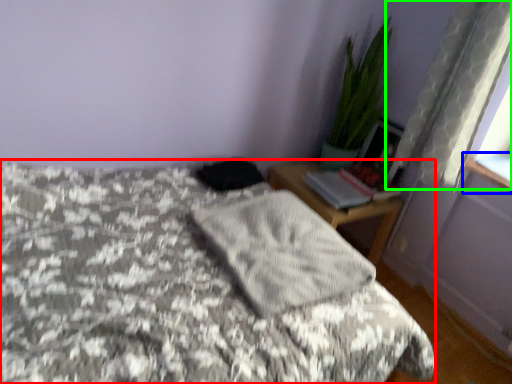
Question: Which object is the farthest from bed (highlighted by a red box)? Choose among these: window sill (highlighted by a blue box) or curtain (highlighted by a green box).

Choices:
 (A) window sill
 (B) curtain

Answer: (A)